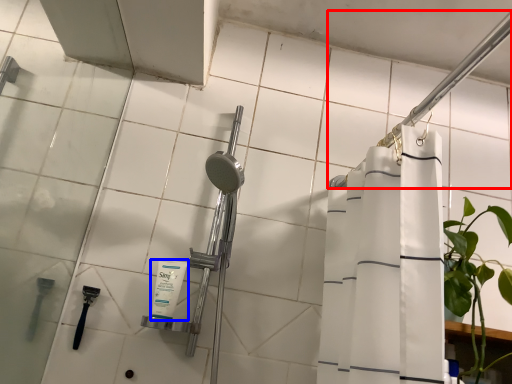
Question: Which object appears closest to the camera in this image, shower (highlighted by a red box) or toiletry (highlighted by a blue box)?

Choices:
 (A) shower
 (B) toiletry

Answer: (A)